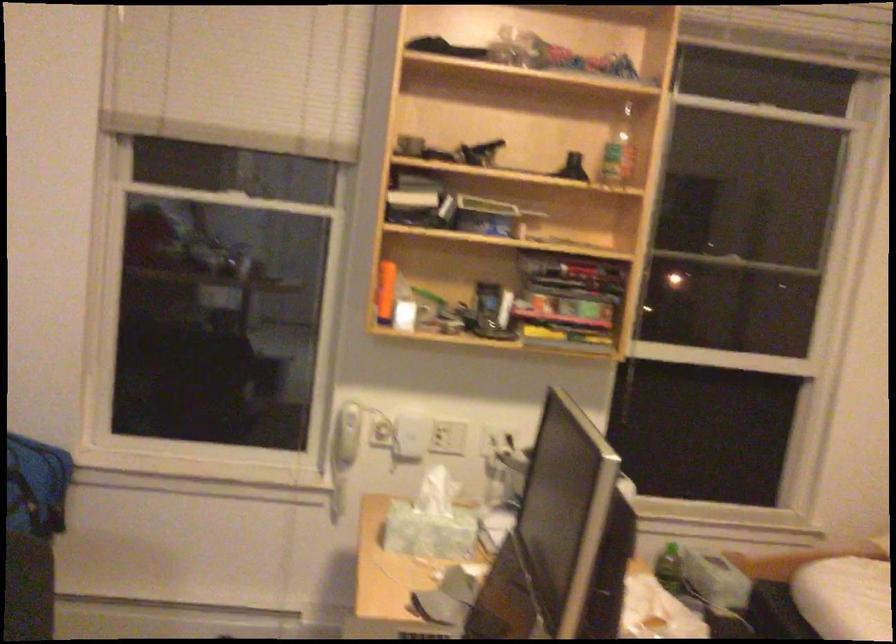
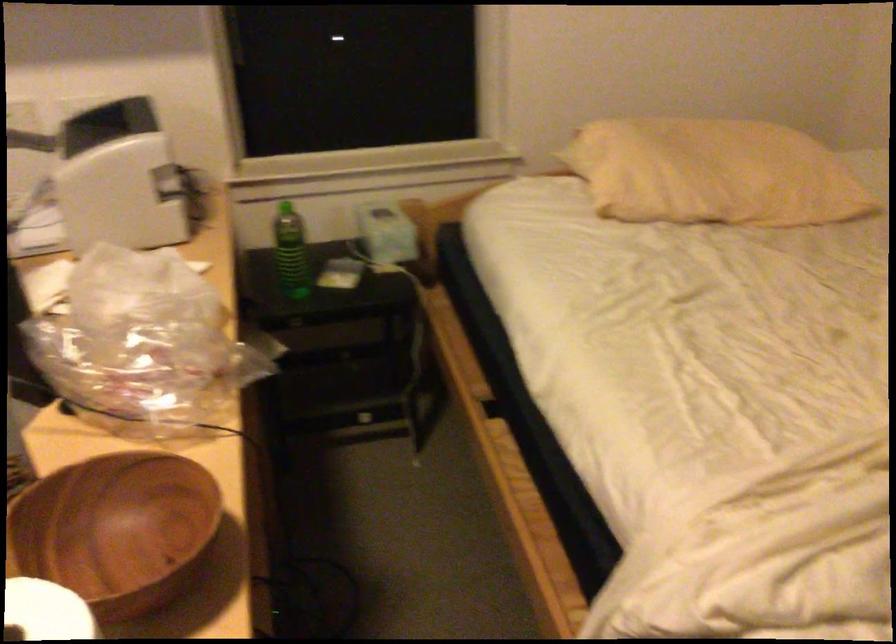
The images are taken continuously from a first-person perspective. In which direction are you moving?

The cameraman moved toward right, forward.